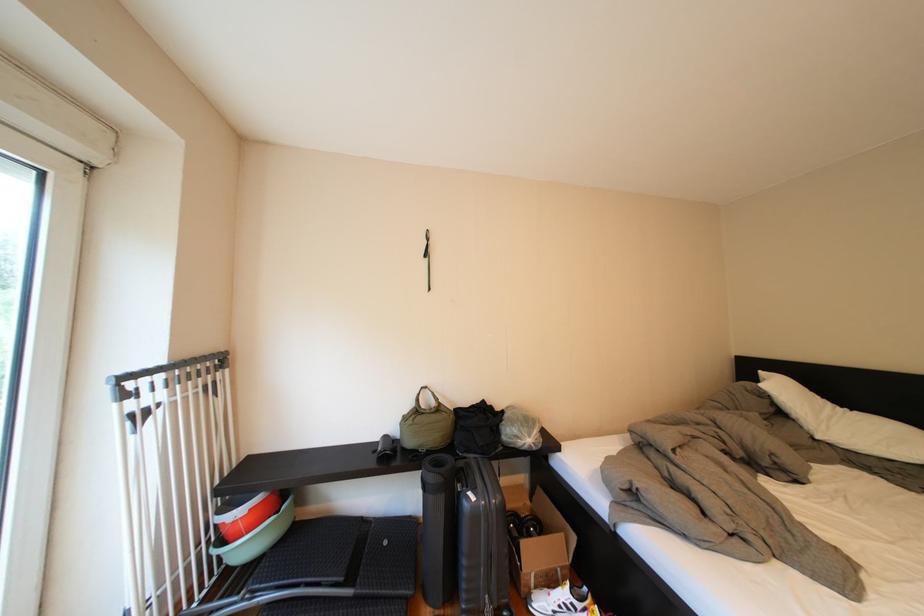
What do you see at coordinates (427, 424) in the screenshot? The height and width of the screenshot is (616, 924). I see `the green bag handle` at bounding box center [427, 424].